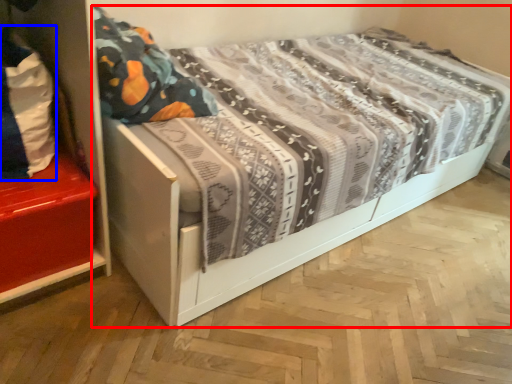
Question: Which of the following is the closest to the observer, bed (highlighted by a red box) or material (highlighted by a blue box)?

Choices:
 (A) bed
 (B) material

Answer: (A)